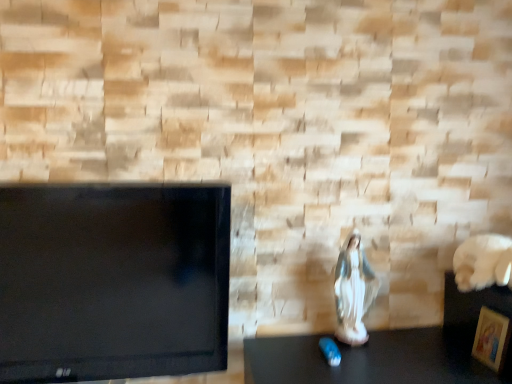
Question: Does porcelain statue at center lie behind wooden picture frame at lower right?

Choices:
 (A) yes
 (B) no

Answer: (A)

Question: Is porcelain statue at center at the left side of wooden picture frame at lower right?

Choices:
 (A) no
 (B) yes

Answer: (B)

Question: Is porcelain statue at center smaller than wooden picture frame at lower right?

Choices:
 (A) no
 (B) yes

Answer: (A)

Question: Is porcelain statue at center turned away from wooden picture frame at lower right?

Choices:
 (A) no
 (B) yes

Answer: (A)

Question: From a real-world perspective, does porcelain statue at center sit lower than wooden picture frame at lower right?

Choices:
 (A) no
 (B) yes

Answer: (A)

Question: Considering the relative sizes of porcelain statue at center and wooden picture frame at lower right in the image provided, is porcelain statue at center taller than wooden picture frame at lower right?

Choices:
 (A) yes
 (B) no

Answer: (A)

Question: Is wooden picture frame at lower right bigger than porcelain statue at center?

Choices:
 (A) yes
 (B) no

Answer: (B)

Question: From the image's perspective, is wooden picture frame at lower right located above porcelain statue at center?

Choices:
 (A) yes
 (B) no

Answer: (B)

Question: Considering the relative sizes of wooden picture frame at lower right and porcelain statue at center in the image provided, is wooden picture frame at lower right shorter than porcelain statue at center?

Choices:
 (A) yes
 (B) no

Answer: (A)

Question: From the image's perspective, is wooden picture frame at lower right beneath porcelain statue at center?

Choices:
 (A) no
 (B) yes

Answer: (B)

Question: Is wooden picture frame at lower right turned away from porcelain statue at center?

Choices:
 (A) no
 (B) yes

Answer: (A)

Question: Is wooden picture frame at lower right not within porcelain statue at center?

Choices:
 (A) no
 (B) yes

Answer: (B)

Question: From a real-world perspective, is porcelain statue at center physically located above or below wooden picture frame at lower right?

Choices:
 (A) below
 (B) above

Answer: (B)